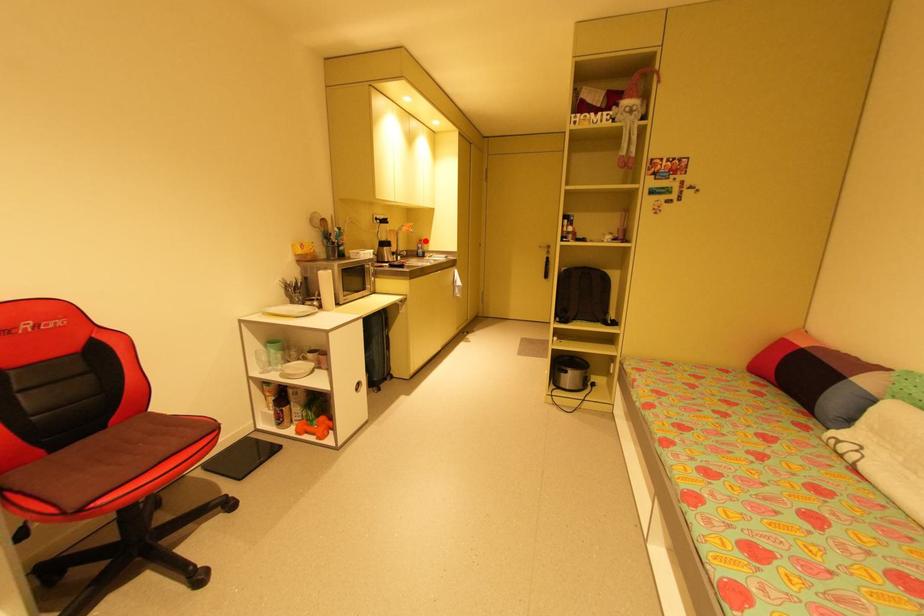
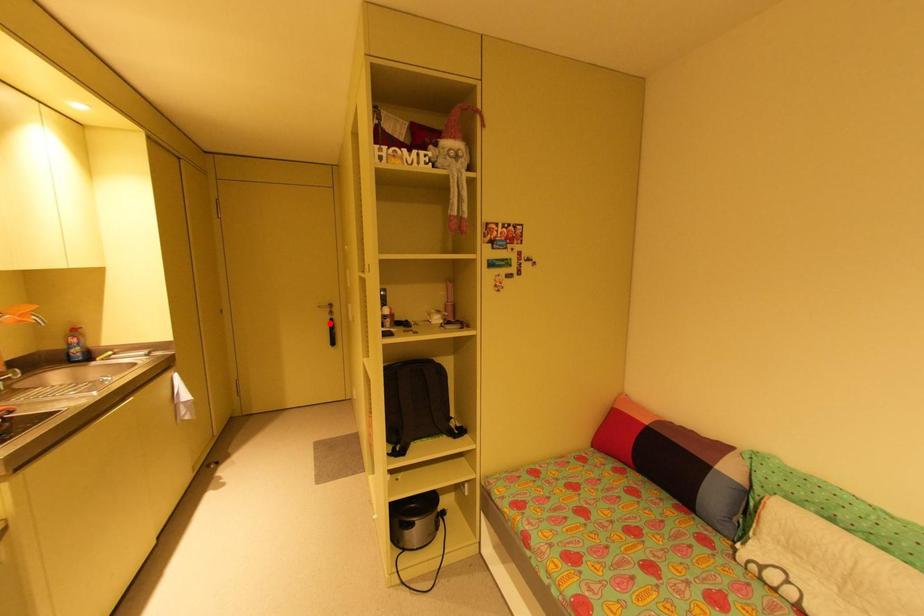
I am providing you with two images of the same scene from different viewpoints. A red point is marked on the first image and another point is marked on the second image. Is the red point in image1 aligned with the point shown in image2?

No